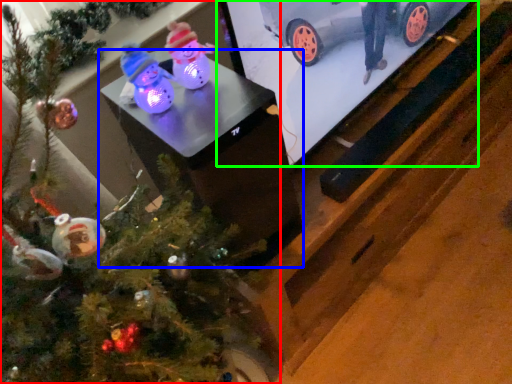
Question: Considering the real-world distances, which object is closest to christmas tree (highlighted by a red box)? table (highlighted by a blue box) or tv show (highlighted by a green box).

Choices:
 (A) table
 (B) tv show

Answer: (A)